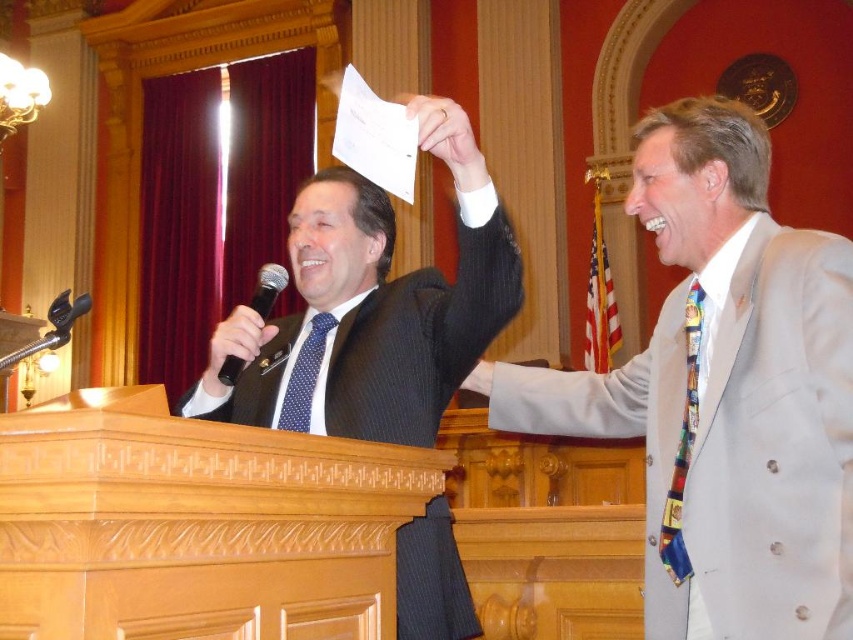
Question: Is multicolored fabric tie at right positioned in front of smooth leather hand at upper right?

Choices:
 (A) yes
 (B) no

Answer: (A)

Question: Estimate the real-world distances between objects in this image. Which object is farther from the light gray suit at right?

Choices:
 (A) smooth leather hand at upper right
 (B) black plastic microphone at left

Answer: (B)

Question: Estimate the real-world distances between objects in this image. Which object is closer to the matte black suit at center?

Choices:
 (A) smooth leather hand at upper right
 (B) blue dotted tie at center
 (C) light gray suit at right

Answer: (B)

Question: Is light gray suit at right positioned in front of black plastic microphone at left?

Choices:
 (A) yes
 (B) no

Answer: (A)

Question: Which point is farther to the camera?

Choices:
 (A) (379, 308)
 (B) (219, 376)
 (C) (692, 294)

Answer: (A)

Question: Where is light gray suit at right located in relation to blue dotted tie at center in the image?

Choices:
 (A) below
 (B) above

Answer: (B)